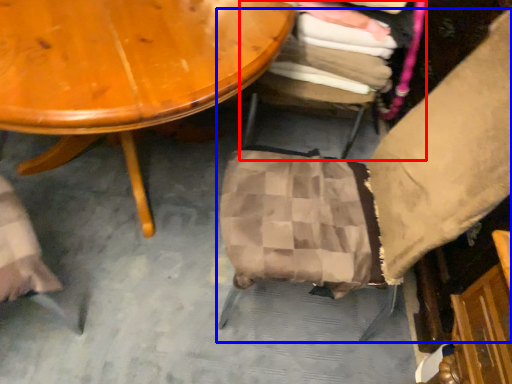
Question: Among these objects, which one is nearest to the camera, chair (highlighted by a red box) or chair (highlighted by a blue box)?

Choices:
 (A) chair
 (B) chair

Answer: (B)